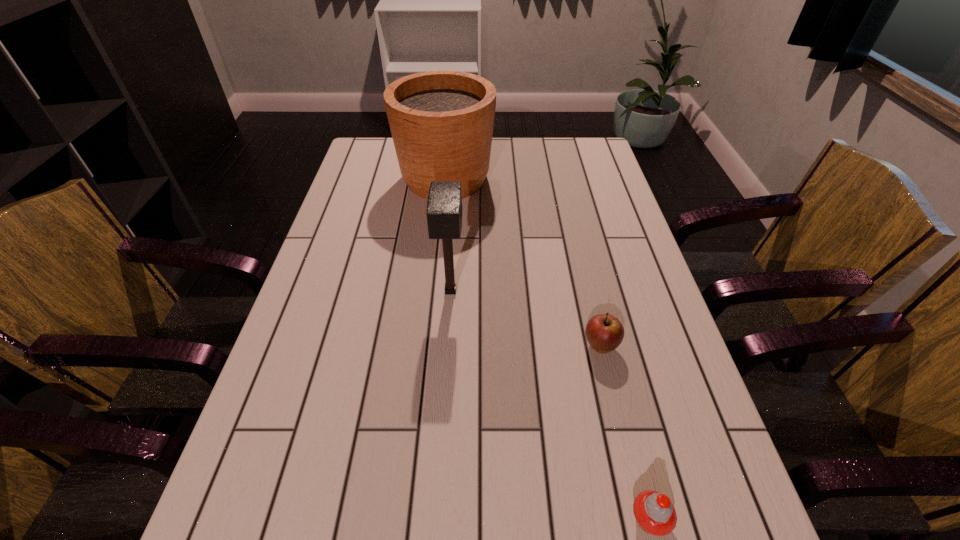
I want to click on free space at the far edge, so click(509, 159).

Find the location of a particular element. This screenshot has height=540, width=960. blank space at the left edge of the desktop is located at coordinates (352, 312).

Locate an element on the screen. Image resolution: width=960 pixels, height=540 pixels. free space at the right edge of the desktop is located at coordinates (626, 281).

The image size is (960, 540). Identify the location of free spot at the far right corner of the desktop. (562, 159).

The width and height of the screenshot is (960, 540). I want to click on unoccupied position between the third farthest object and the second farthest object, so click(525, 319).

Find the location of `object that stands as the second closest to the second farthest object`. object that stands as the second closest to the second farthest object is located at coordinates (441, 122).

Locate which object ranks third in proximity to the mallet. Please provide its 2D coordinates. Your answer should be formatted as a tuple, i.e. [(x, y)], where the tuple contains the x and y coordinates of a point satisfying the conditions above.

[(655, 514)]

This screenshot has width=960, height=540. Identify the location of free space that satisfies the following two spatial constraints: 1. on the front side of the flowerpot; 2. on the right side of the apple. (429, 347).

The width and height of the screenshot is (960, 540). In order to click on free space that satisfies the following two spatial constraints: 1. on the front side of the flowerpot; 2. on the right side of the apple in this screenshot , I will do `click(429, 347)`.